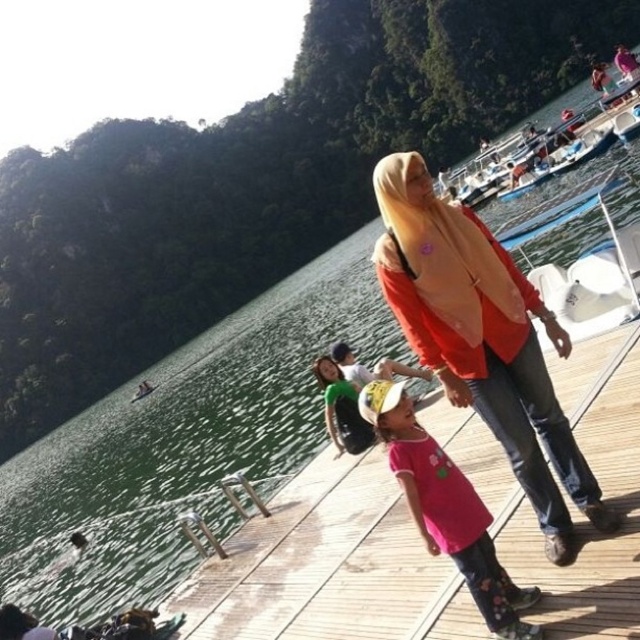
You are standing at the entrance of the dock and want to locate the matte orange sweater at center. According to the coordinates given, in which direction should you look relative to your position?

The matte orange sweater at center is located at coordinates point [483,339]. Since coordinates typically start from the bottom left corner, 0.531 on the x axis is slightly to the right of center, and 0.755 on the y axis is about three quarters up from the bottom. Therefore, you should look towards the upper right direction from your current position at the dock entrance.